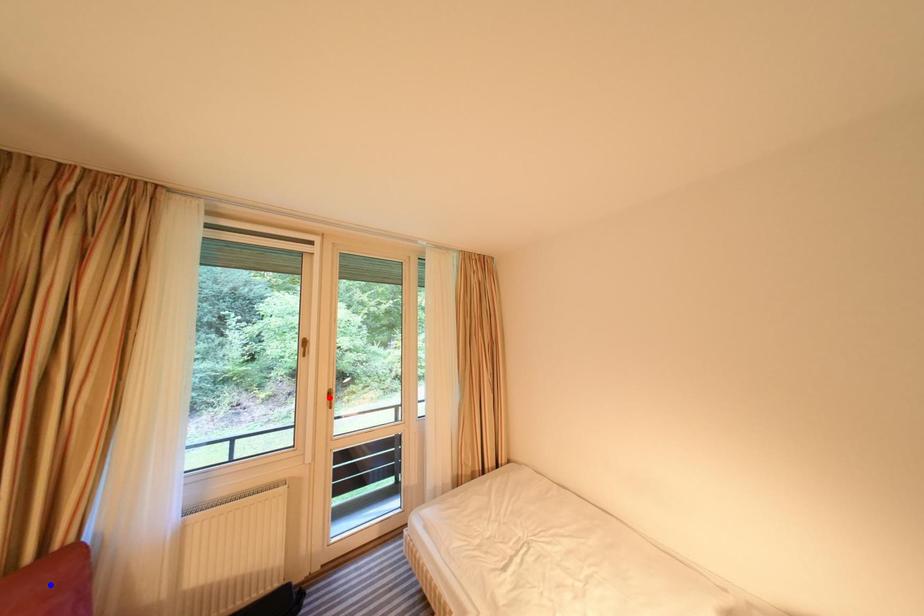
Question: In the image, two points are highlighted. Which point is nearer to the camera? Reply with the corresponding letter.

Choices:
 (A) blue point
 (B) red point

Answer: (A)